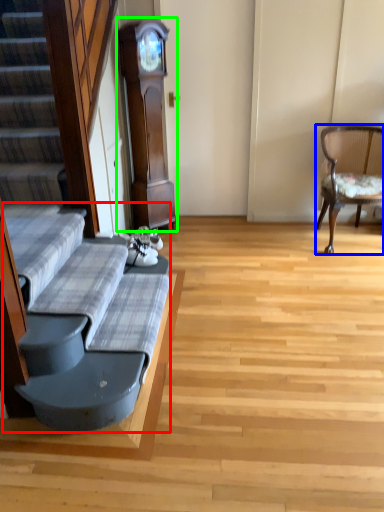
Question: Based on their relative distances, which object is nearer to couch (highlighted by a red box)? Choose from chair (highlighted by a blue box) and cabinetry (highlighted by a green box).

Choices:
 (A) chair
 (B) cabinetry

Answer: (B)